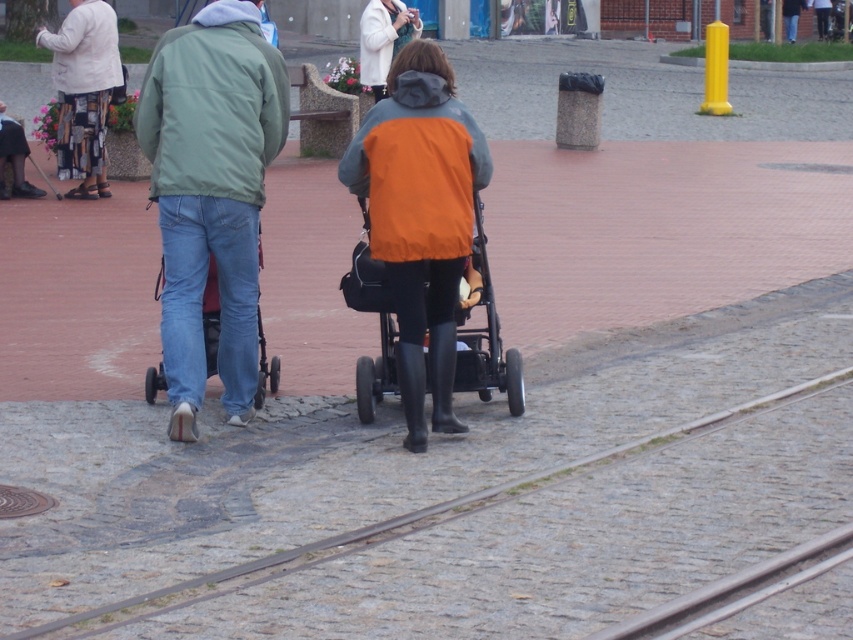
You are a delivery person who needs to pass between the green matte jacket at center and the white wool coat at upper center. The delivery cart you are using is 1.2 meters wide. Can you fit through the space between them?

The green matte jacket at center is wider than the white wool coat at upper center. However, the question is about the space between them, not their widths. Since the objects description only compares their widths and does not provide information about the distance between them, we cannot determine if the delivery cart can fit through the space. More information about the distance between the two objects is needed.

You are a pedestrian walking on the cobblestone street and see the green matte jacket at center and the white wool coat at upper center. Which one is closer to you?

The green matte jacket at center is closer to you because it is in front of the white wool coat at upper center.

You are a pedestrian trying to cross the street and see the green matte jacket at center and the orange matte vest at center. Which one is higher up in the image?

The green matte jacket at center is above the orange matte vest at center, so the green matte jacket at center is higher up in the image.